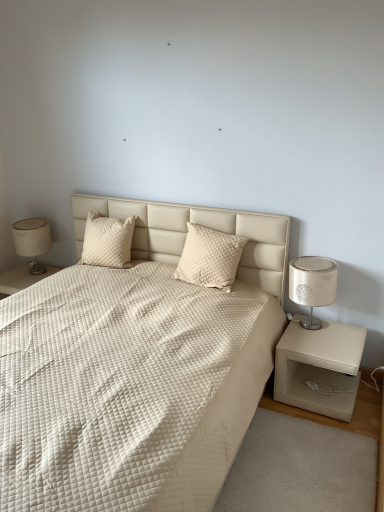
The width and height of the screenshot is (384, 512). In order to click on free region under white textured lamp at right (from a real-world perspective) in this screenshot , I will do `click(312, 328)`.